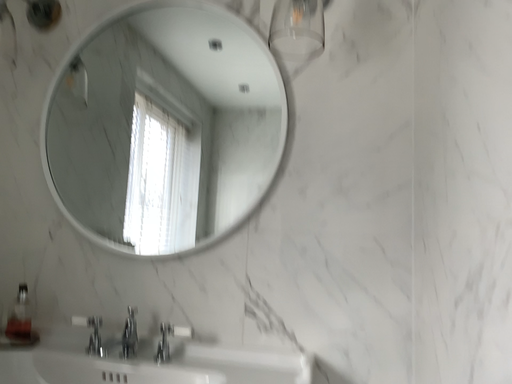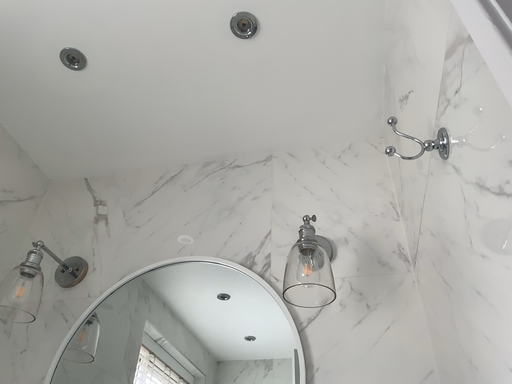
Question: How did the camera likely rotate when shooting the video?

Choices:
 (A) rotated downward
 (B) rotated upward

Answer: (B)